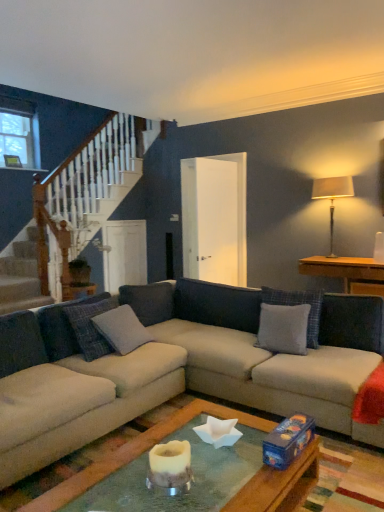
Question: Is wooden side table at right aimed at gray fabric pillow at center, the 1th pillow positioned from the right?

Choices:
 (A) no
 (B) yes

Answer: (B)

Question: Is wooden side table at right at the right side of gray fabric pillow at center, the 1th pillow positioned from the right?

Choices:
 (A) no
 (B) yes

Answer: (B)

Question: Is wooden side table at right facing away from gray fabric pillow at center, the 1th pillow positioned from the right?

Choices:
 (A) yes
 (B) no

Answer: (B)

Question: Is wooden side table at right positioned beyond the bounds of gray fabric pillow at center, the 1th pillow positioned from the right?

Choices:
 (A) yes
 (B) no

Answer: (A)

Question: Is wooden side table at right in contact with gray fabric pillow at center, the 1th pillow positioned from the right?

Choices:
 (A) yes
 (B) no

Answer: (B)

Question: Choose the correct answer: Is white ceramic candle holder at center inside wooden side table at right or outside it?

Choices:
 (A) inside
 (B) outside

Answer: (B)

Question: Is white ceramic candle holder at center to the left or to the right of wooden side table at right in the image?

Choices:
 (A) right
 (B) left

Answer: (B)

Question: In terms of width, does white ceramic candle holder at center look wider or thinner when compared to wooden side table at right?

Choices:
 (A) thin
 (B) wide

Answer: (A)

Question: Is white ceramic candle holder at center bigger or smaller than wooden side table at right?

Choices:
 (A) small
 (B) big

Answer: (A)

Question: In terms of width, does beige fabric couch at center look wider or thinner when compared to silky beige lampshade at upper right?

Choices:
 (A) wide
 (B) thin

Answer: (A)

Question: Is beige fabric couch at center inside or outside of silky beige lampshade at upper right?

Choices:
 (A) inside
 (B) outside

Answer: (B)

Question: From the image's perspective, is beige fabric couch at center located above or below silky beige lampshade at upper right?

Choices:
 (A) below
 (B) above

Answer: (A)

Question: In terms of height, does beige fabric couch at center look taller or shorter compared to silky beige lampshade at upper right?

Choices:
 (A) short
 (B) tall

Answer: (A)

Question: Would you say gray fabric pillow at center, which ranks as the first pillow in left-to-right order, is inside or outside beige fabric couch at center?

Choices:
 (A) inside
 (B) outside

Answer: (A)

Question: In the image, is gray fabric pillow at center, which ranks as the first pillow in left-to-right order, on the left side or the right side of beige fabric couch at center?

Choices:
 (A) right
 (B) left

Answer: (B)